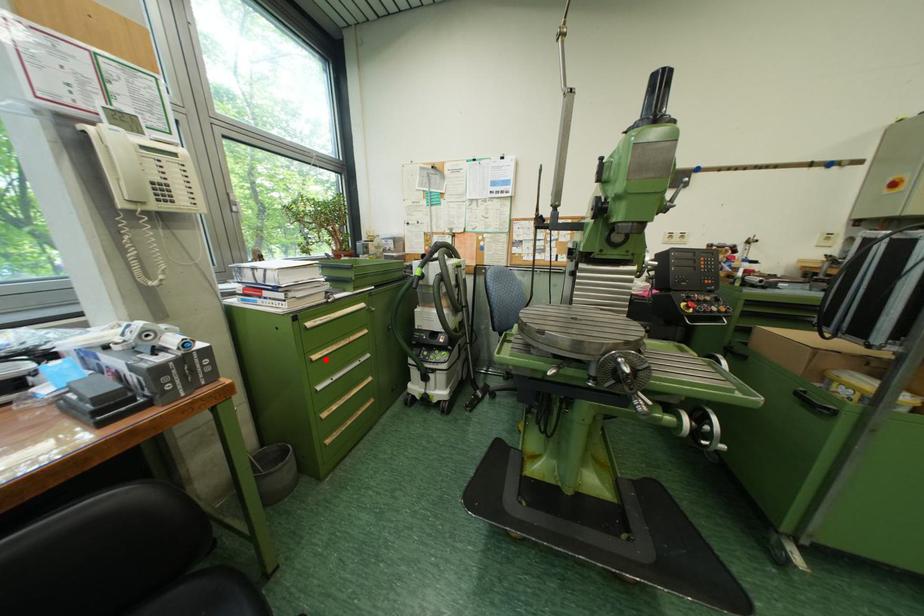
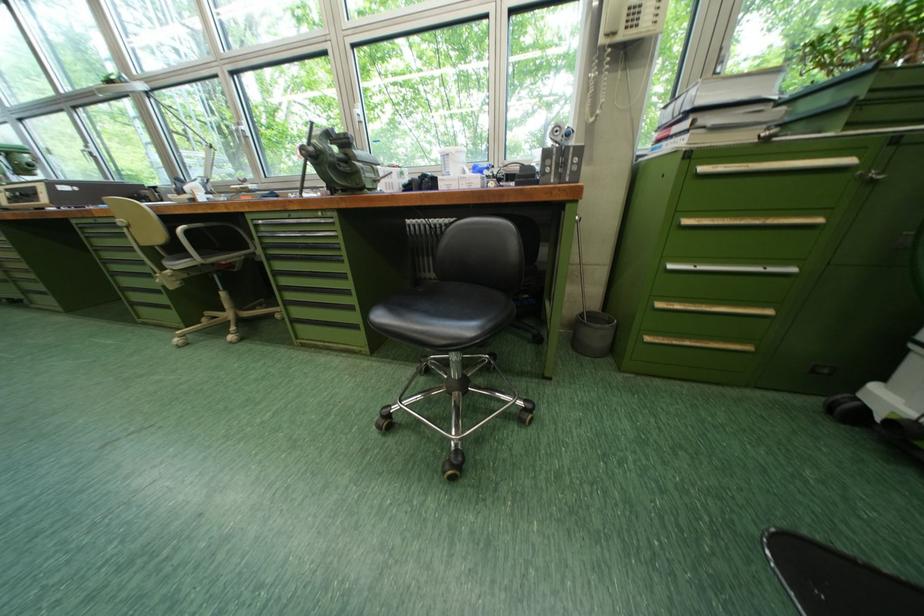
Where in the second image is the point corresponding to the highlighted location from the first image?

(698, 224)